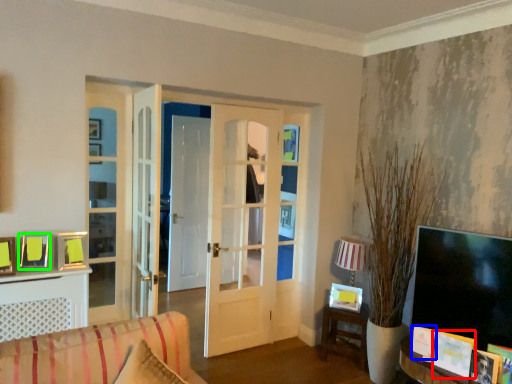
Question: Considering the real-world distances, which object is closest to book (highlighted by a red box)? picture frame (highlighted by a blue box) or picture frame (highlighted by a green box).

Choices:
 (A) picture frame
 (B) picture frame

Answer: (A)